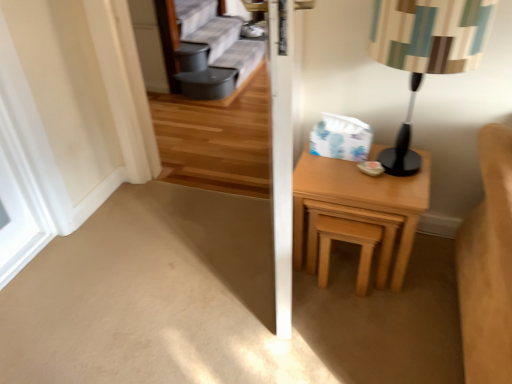
The width and height of the screenshot is (512, 384). What are the coordinates of `free spot to the right of white matte window at left` in the screenshot? It's located at (109, 219).